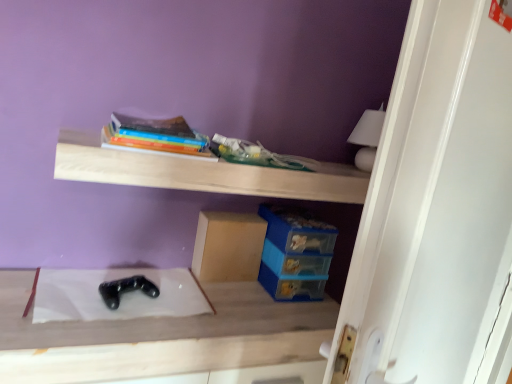
Identify the location of vacant area that lies to the right of matte cardboard box at center. (265, 294).